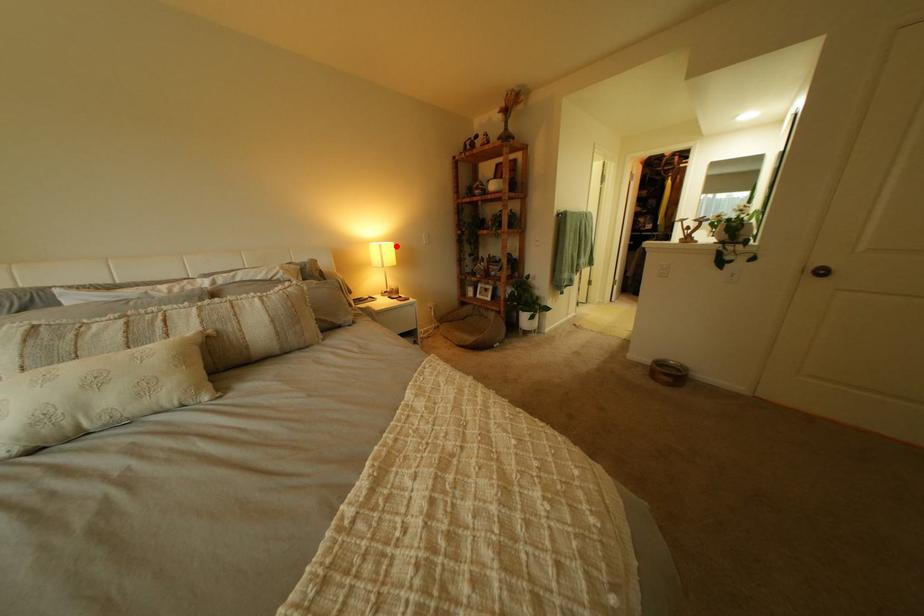
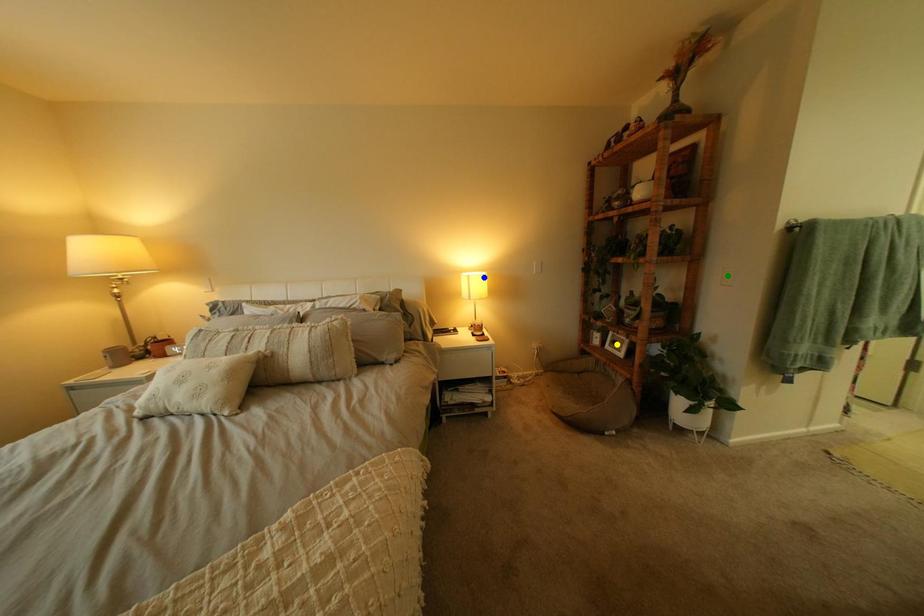
Question: I am providing you with two images of the same scene from different viewpoints. A red point is marked on the first image. You are given multiple points on the second image. Which point in image 2 represents the same 3d spot as the red point in image 1?

Choices:
 (A) green point
 (B) blue point
 (C) yellow point

Answer: (B)